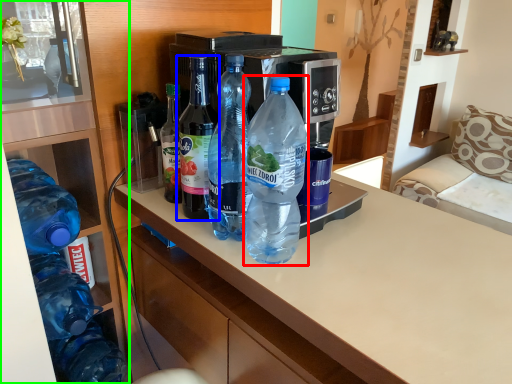
Question: Which is farther away from bottle (highlighted by a red box)? bottle (highlighted by a blue box) or cabinetry (highlighted by a green box)?

Choices:
 (A) bottle
 (B) cabinetry

Answer: (B)